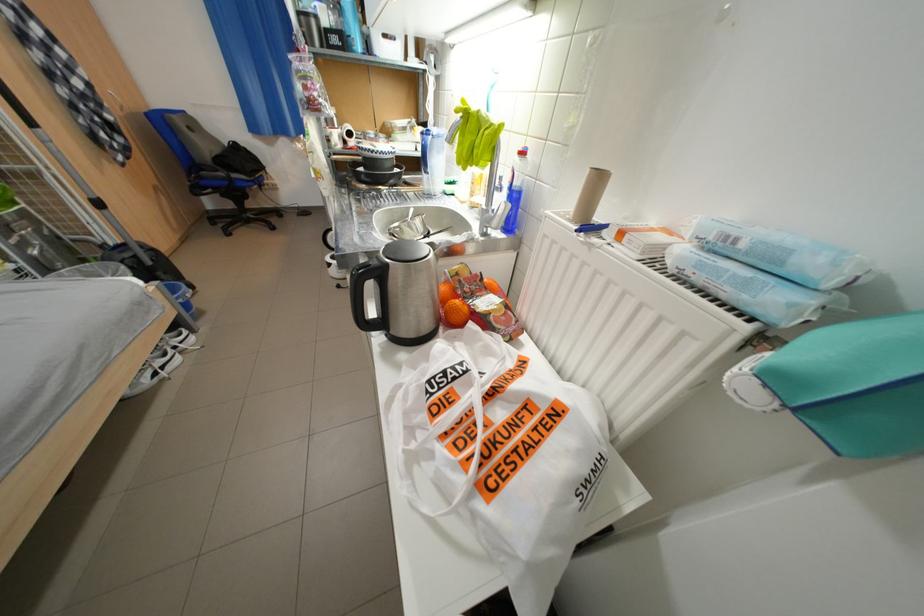
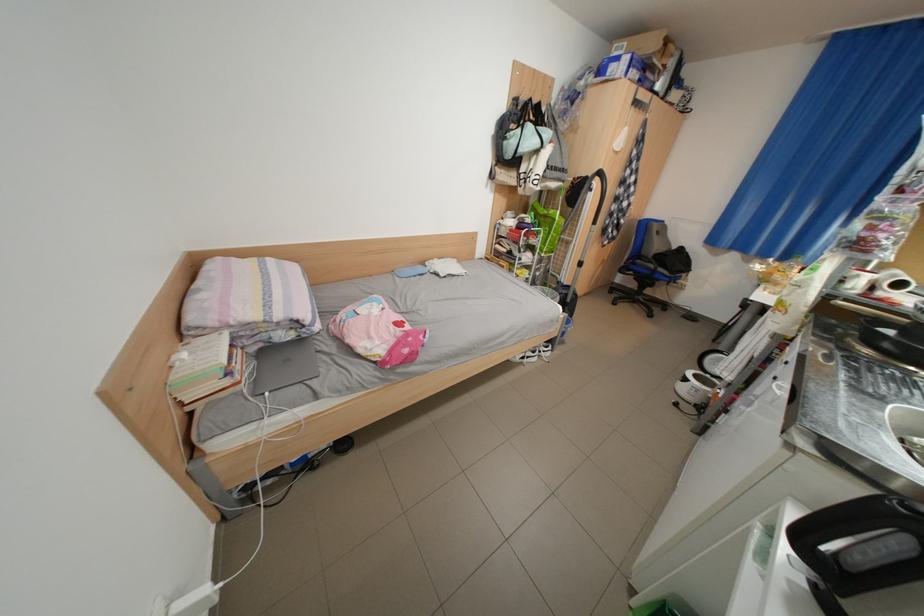
Question: I am providing you with two images of the same scene from different viewpoints. Which of the following objects are not visible in image2?

Choices:
 (A) trolley handle
 (B) cardboard box
 (C) chair armrest
 (D) none of these

Answer: (D)